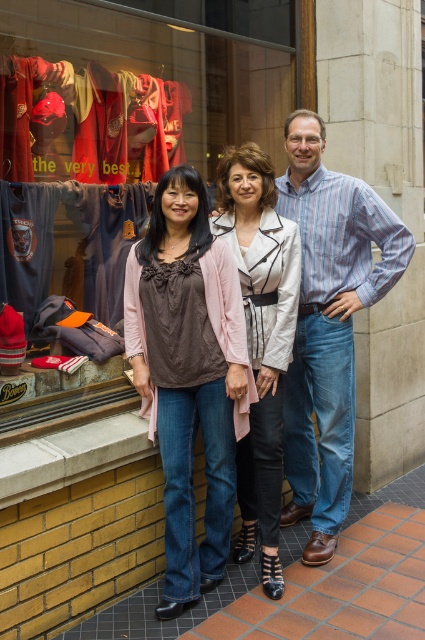
Question: Which of the following is the closest to the observer?

Choices:
 (A) (192, 310)
 (B) (289, 220)

Answer: (A)

Question: Among these objects, which one is nearest to the camera?

Choices:
 (A) blue striped shirt at center
 (B) matte white jacket at center

Answer: (B)

Question: Which point is farther from the camera taking this photo?

Choices:
 (A) (255, 417)
 (B) (337, 428)
 (C) (187, 486)

Answer: (B)

Question: Can you confirm if blue striped shirt at center is thinner than matte white jacket at center?

Choices:
 (A) yes
 (B) no

Answer: (B)

Question: Does matte brown blouse at center have a smaller size compared to blue striped shirt at center?

Choices:
 (A) yes
 (B) no

Answer: (A)

Question: Can you confirm if blue striped shirt at center is bigger than matte white jacket at center?

Choices:
 (A) no
 (B) yes

Answer: (B)